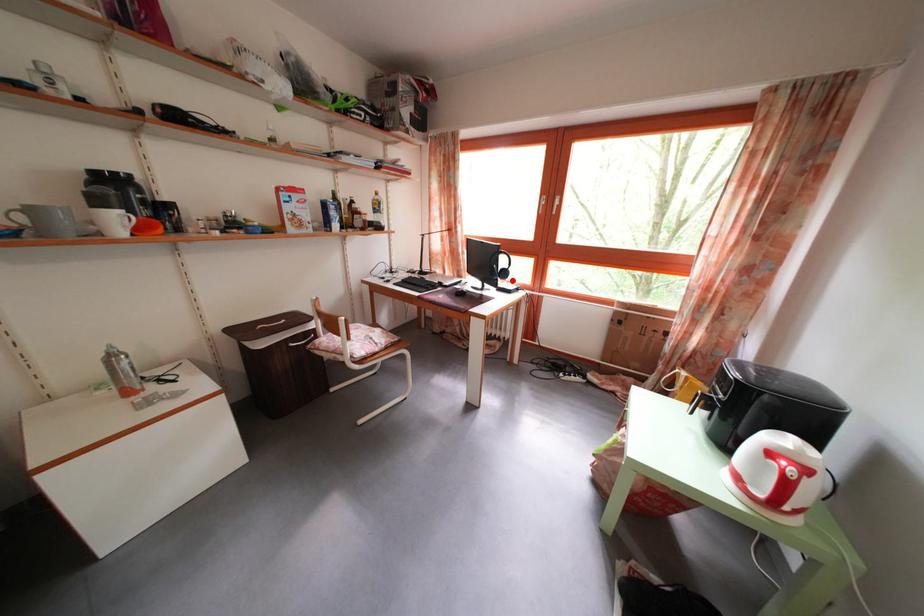
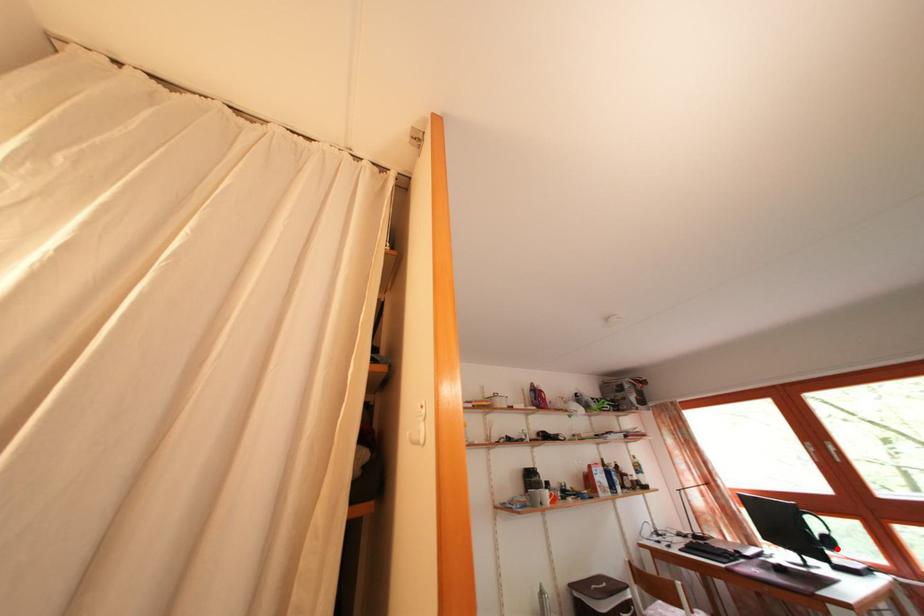
I am providing you with two images of the same scene from different viewpoints. A red point is marked on the first image and another point is marked on the second image. Do the highlighted points in image1 and image2 indicate the same real-world spot?

Yes